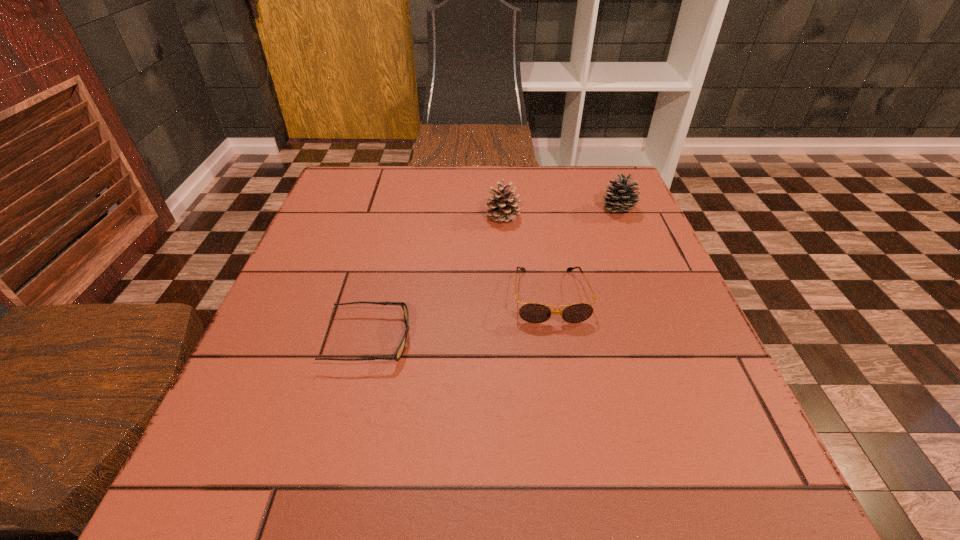
Locate an element on the screen. The width and height of the screenshot is (960, 540). free space between the rightmost object and the right sunglasses is located at coordinates (585, 253).

Locate an element on the screen. The height and width of the screenshot is (540, 960). free spot between the left sunglasses and the left pinecone is located at coordinates (436, 278).

Locate an element on the screen. free spot between the rightmost object and the left pinecone is located at coordinates (561, 213).

The width and height of the screenshot is (960, 540). I want to click on empty space that is in between the rightmost object and the left pinecone, so click(x=561, y=213).

Locate an element on the screen. This screenshot has width=960, height=540. free spot between the taller sunglasses and the shorter sunglasses is located at coordinates (460, 318).

Locate an element on the screen. This screenshot has width=960, height=540. empty location between the right pinecone and the left pinecone is located at coordinates (561, 213).

In order to click on free space between the rightmost object and the right sunglasses in this screenshot , I will do `click(585, 253)`.

The width and height of the screenshot is (960, 540). Find the location of `empty space that is in between the shorter sunglasses and the rightmost object`. empty space that is in between the shorter sunglasses and the rightmost object is located at coordinates tap(494, 274).

Locate an element on the screen. The image size is (960, 540). free area in between the rightmost object and the left pinecone is located at coordinates (561, 213).

Image resolution: width=960 pixels, height=540 pixels. I want to click on free space between the left pinecone and the shortest object, so click(436, 278).